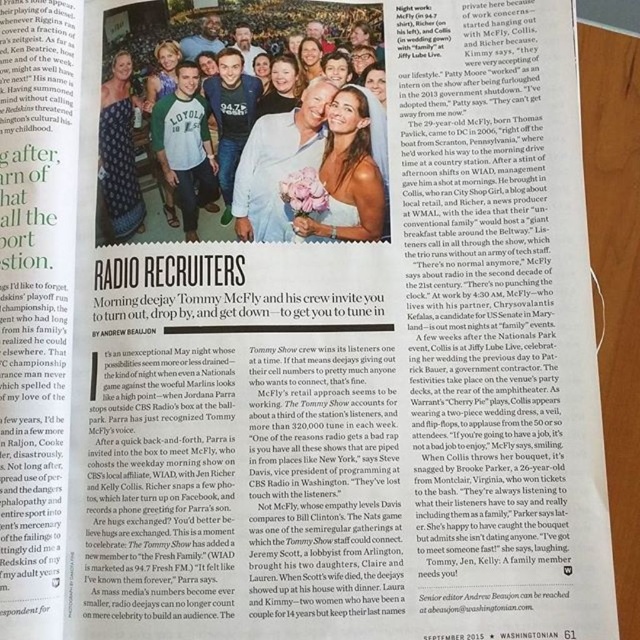
Who is shorter, matte gold necklace at center or blue denim dress at upper left?

matte gold necklace at center is shorter.

Is point (266, 236) closer to viewer compared to point (125, 168)?

Yes, it is.

Where is `matte gold necklace at center`? This screenshot has height=640, width=640. matte gold necklace at center is located at coordinates (276, 163).

Between matte green t-shirt at center and green jersey at center, which one is positioned higher?

Positioned higher is matte green t-shirt at center.

Who is more forward, (x=256, y=236) or (x=163, y=140)?

Point (x=256, y=236)

Does point (288, 132) come farther from viewer compared to point (180, 124)?

No, (288, 132) is in front of (180, 124).

Find the location of a particular element. The height and width of the screenshot is (640, 640). matte green t-shirt at center is located at coordinates (228, 148).

Can you confirm if matte green t-shirt at center is shorter than matte brown hair at center?

In fact, matte green t-shirt at center may be taller than matte brown hair at center.

Is matte green t-shirt at center thinner than matte brown hair at center?

In fact, matte green t-shirt at center might be wider than matte brown hair at center.

What are the coordinates of `matte green t-shirt at center` in the screenshot? It's located at (228, 148).